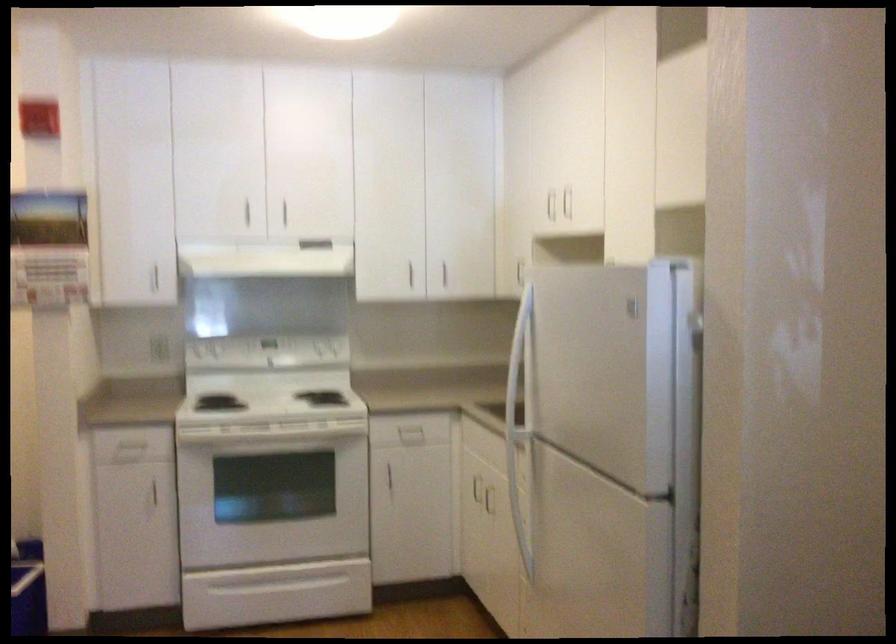
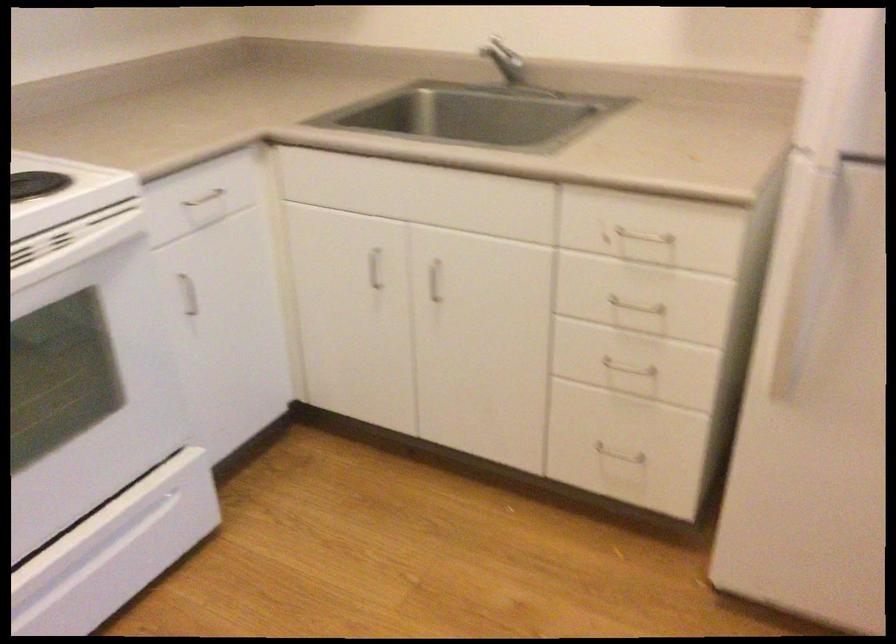
In the second image, find the point that corresponds to [321,426] in the first image.

(73, 243)